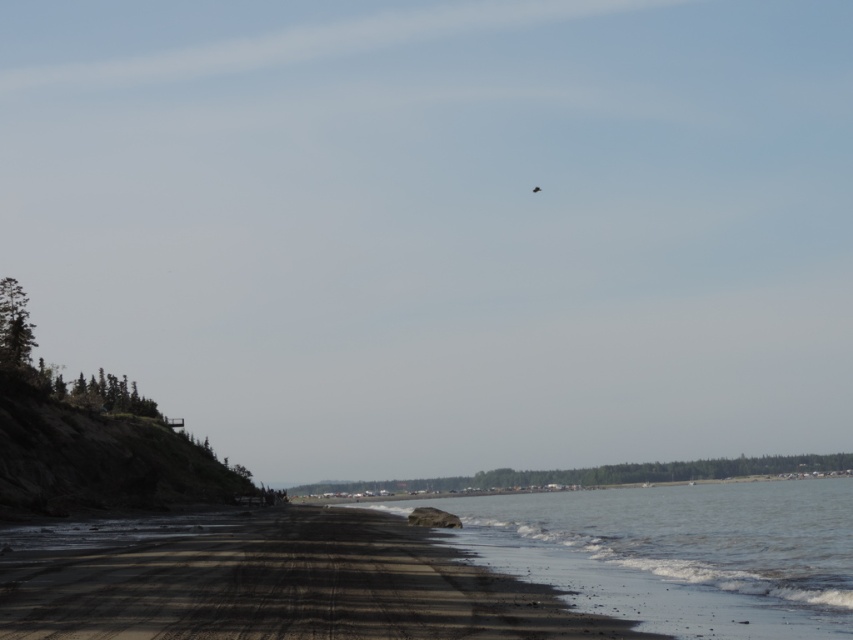
You are a beachcomber searching for treasures along the shore. You notice the dark sand beach at lower left and the black sand at lower right. Which area has a wider stretch of sand? Please refer to their widths as described.

The black sand at lower right has a wider stretch of sand compared to the dark sand beach at lower left.

Consider the image. You are standing on the beach in the coastal scene. You see two points marked on the image. The first point is at coordinates point (403, 561) and the second point is at point (577, 499). Which point is closer to you?

The point at coordinates point (403, 561) is closer to you because it is in front of point (577, 499).